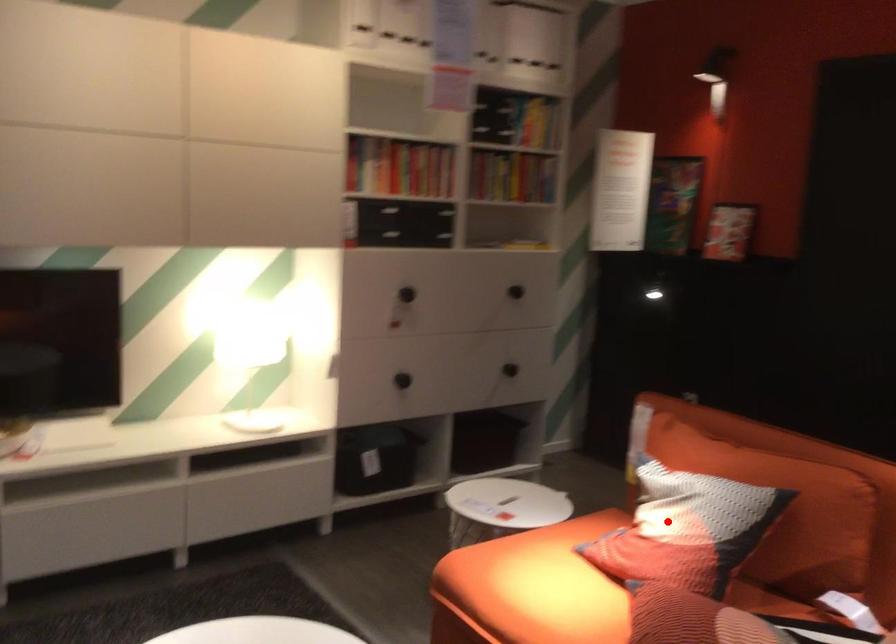
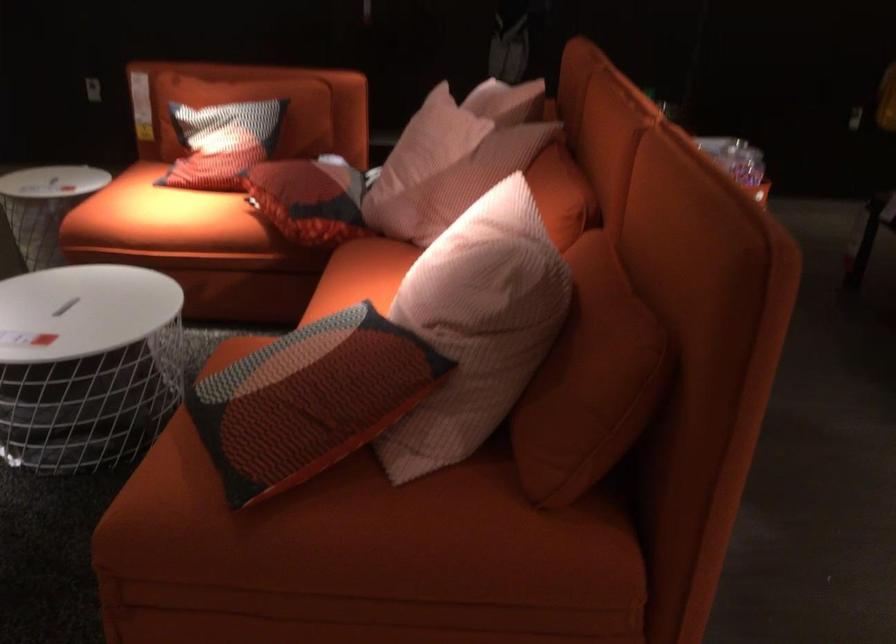
Question: I am providing you with two images of the same scene from different viewpoints. In image1, a red point is highlighted. Considering the same 3D point in image2, which of the following is correct?

Choices:
 (A) It is closer
 (B) It is farther

Answer: (B)